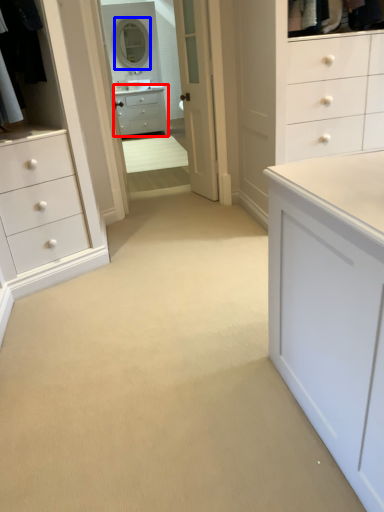
Question: Which object appears closest to the camera in this image, chest of drawers (highlighted by a red box) or mirror (highlighted by a blue box)?

Choices:
 (A) chest of drawers
 (B) mirror

Answer: (B)